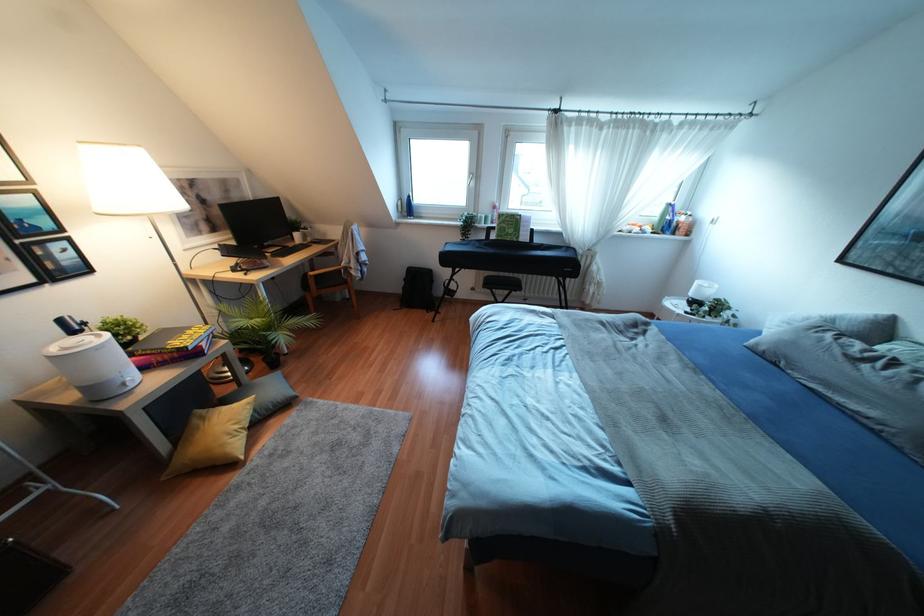
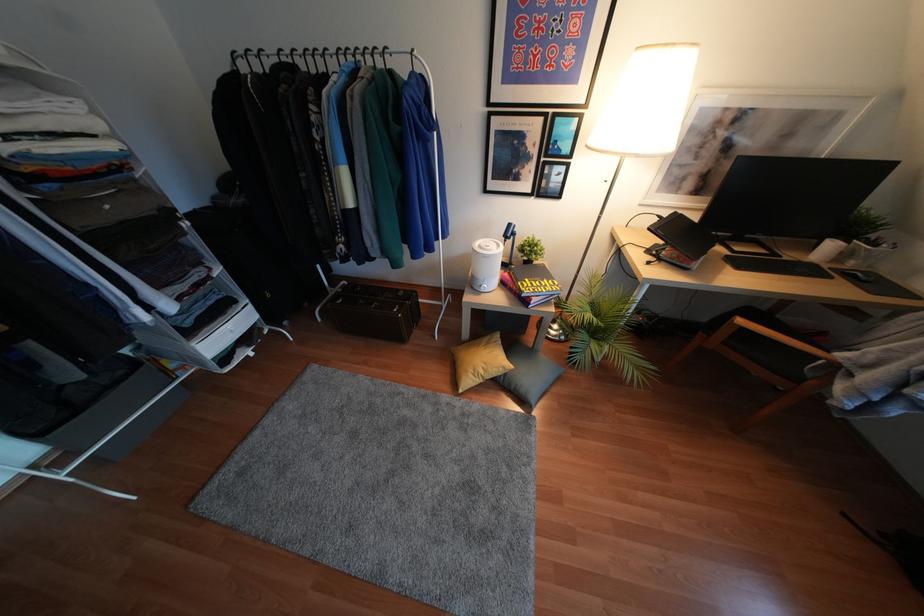
The point at (130,385) is marked in the first image. Where is the corresponding point in the second image?

(481, 290)